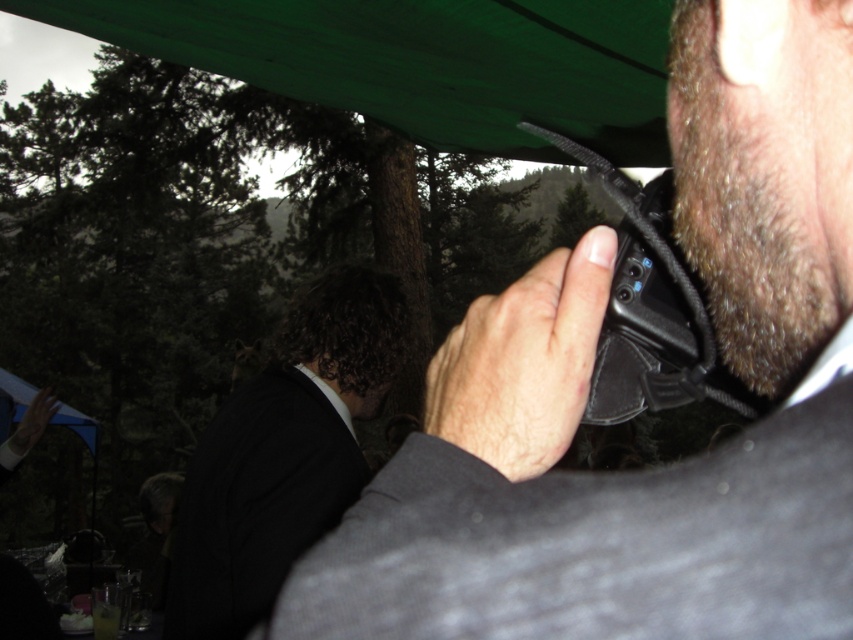
Question: Can you confirm if black matte walkie-talkie at center is positioned above green fabric canopy at upper center?

Choices:
 (A) yes
 (B) no

Answer: (B)

Question: Which object is closer to the camera taking this photo?

Choices:
 (A) smooth black phone at center
 (B) black matte walkie-talkie at center

Answer: (B)

Question: Does black wool suit at center have a lesser width compared to smooth black phone at center?

Choices:
 (A) no
 (B) yes

Answer: (A)

Question: Which point is closer to the camera?

Choices:
 (A) dark brown fuzzy beard at right side
 (B) black matte walkie-talkie at center
 (C) black wool suit at center

Answer: (B)

Question: Does green fabric canopy at upper center appear over smooth black phone at center?

Choices:
 (A) yes
 (B) no

Answer: (A)

Question: Among these points, which one is farthest from the camera?

Choices:
 (A) (604, 76)
 (B) (815, 118)
 (C) (833, 275)

Answer: (A)